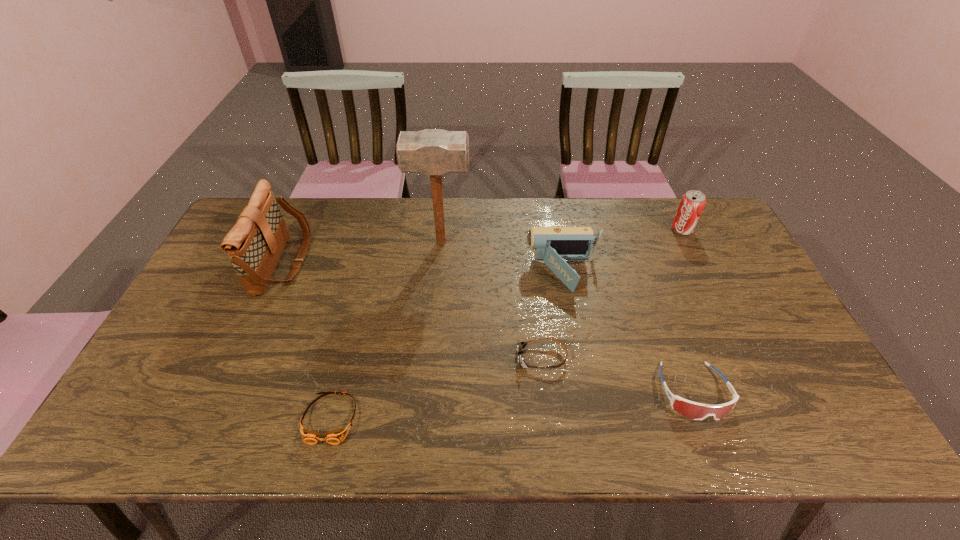
Where is `unoccupied area between the shoulder bag and the second goggles from left to right`? Image resolution: width=960 pixels, height=540 pixels. unoccupied area between the shoulder bag and the second goggles from left to right is located at coordinates [x=413, y=310].

Find the location of a particular element. This screenshot has height=540, width=960. free spot between the second goggles from left to right and the soda can is located at coordinates (612, 294).

Where is `free space between the shoulder bag and the second goggles from right to left`? The height and width of the screenshot is (540, 960). free space between the shoulder bag and the second goggles from right to left is located at coordinates (413, 310).

Locate an element on the screen. Image resolution: width=960 pixels, height=540 pixels. free space between the camcorder and the tallest goggles is located at coordinates (629, 333).

Identify the location of vacant area that lies between the second goggles from right to left and the tallest object. The image size is (960, 540). (492, 300).

This screenshot has height=540, width=960. Find the location of `empty location between the tallest object and the second object from left to right`. empty location between the tallest object and the second object from left to right is located at coordinates (386, 330).

Locate an element on the screen. This screenshot has width=960, height=540. free space between the sixth object from right to left and the shoulder bag is located at coordinates (307, 340).

Image resolution: width=960 pixels, height=540 pixels. Identify the location of free spot between the second object from left to right and the soda can. (506, 324).

Identify the location of free spot between the sixth object from right to left and the tallest goggles. (512, 405).

You are a GUI agent. You are given a task and a screenshot of the screen. Output one action in this format:
    pyautogui.click(x=<x>, y=<y>)
    Task: Click on the free area in between the sixth shortest object and the camcorder
    
    Given the screenshot: What is the action you would take?
    pyautogui.click(x=423, y=268)